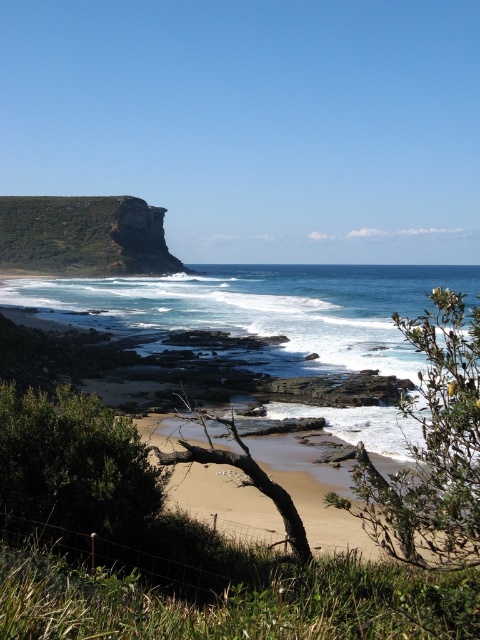
You are a hiker who wants to cross from the green grassy cliff at upper left to the light brown sandy beach at center. Which path would be wider for your journey?

The light brown sandy beach at center is thinner than the green grassy cliff at upper left, so the path from the green grassy cliff at upper left to the light brown sandy beach at center would be wider on the green grassy cliff at upper left side.

You are a hiker standing on the green grassy cliff at upper left and want to reach the light brown sandy beach at center. Which direction should you move to get there?

You should move downward from the green grassy cliff at upper left to reach the light brown sandy beach at center since the beach is located below the cliff.